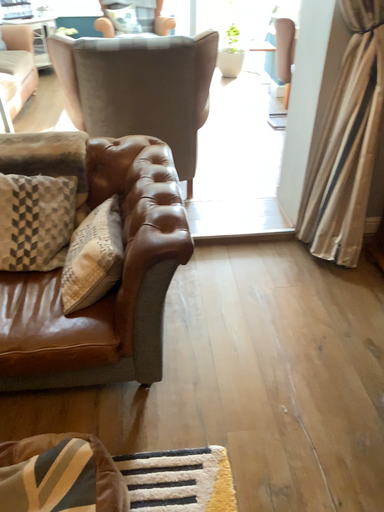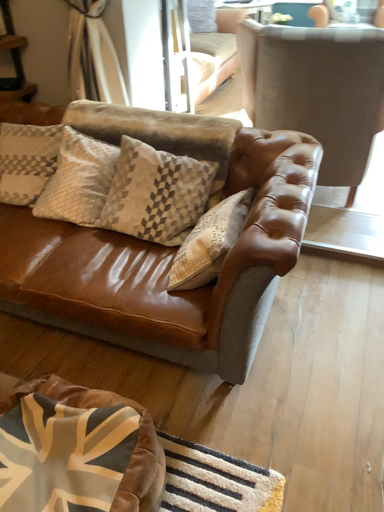
Question: How did the camera likely rotate when shooting the video?

Choices:
 (A) rotated right
 (B) rotated left

Answer: (B)